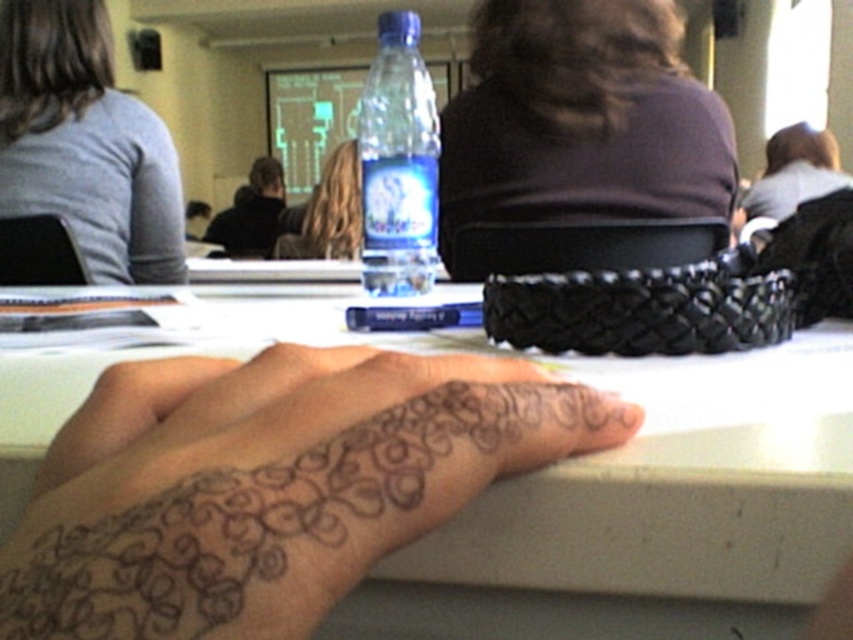
Is point (132, 113) in front of point (257, 176)?

Yes, it is in front of point (257, 176).

Is point (152, 276) closer to camera compared to point (248, 172)?

Yes, it is.

Locate an element on the screen. gray cotton sleeve at upper left is located at coordinates tap(154, 202).

Which is behind, point (495, 81) or point (57, 45)?

Point (57, 45)

Consider the image. Between dark brown fabric at upper center and gray cotton shirt at upper left, which one has less height?

With less height is dark brown fabric at upper center.

This screenshot has height=640, width=853. What do you see at coordinates (581, 120) in the screenshot?
I see `dark brown fabric at upper center` at bounding box center [581, 120].

Identify the location of dark brown fabric at upper center. The image size is (853, 640). (581, 120).

Does point (171, 196) lie behind point (412, 291)?

Yes.

Which is below, gray cotton shirt at upper left or transparent plastic bottle at center?

transparent plastic bottle at center is lower down.

The height and width of the screenshot is (640, 853). I want to click on gray cotton shirt at upper left, so click(85, 144).